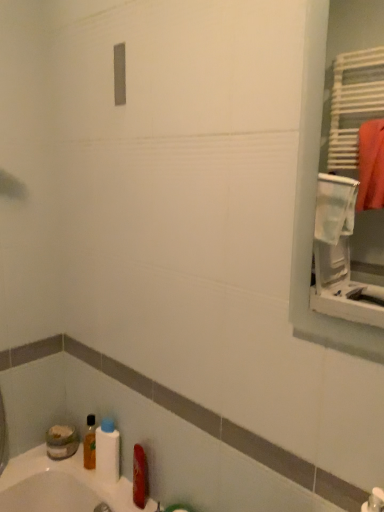
What do you see at coordinates (108, 451) in the screenshot? Image resolution: width=384 pixels, height=512 pixels. I see `white glossy bottle at lower left` at bounding box center [108, 451].

What is the approximate width of white glossy bottle at lower left?

white glossy bottle at lower left is 2.28 inches in width.

Image resolution: width=384 pixels, height=512 pixels. I want to click on white glossy bottle at lower left, so click(108, 451).

Find the location of `white glossy bottle at lower left`. white glossy bottle at lower left is located at coordinates (108, 451).